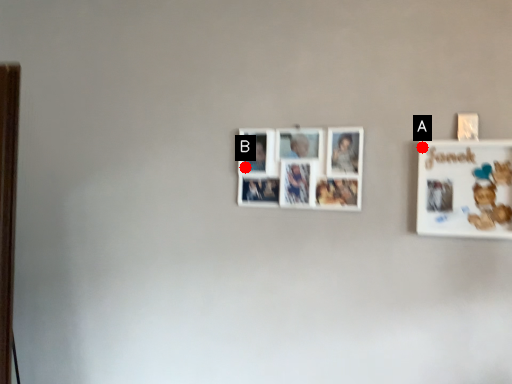
Question: Two points are circled on the image, labeled by A and B beside each circle. Which of the following is the closest to the observer?

Choices:
 (A) A is closer
 (B) B is closer

Answer: (A)